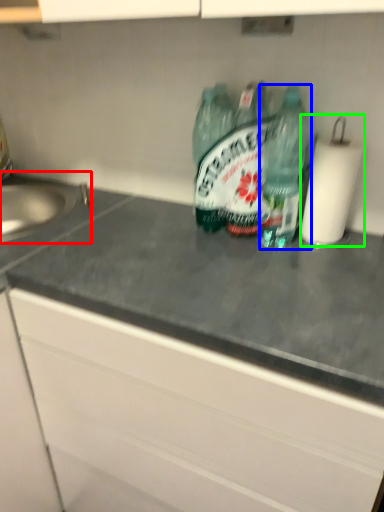
Question: Which object is the closest to the sink (highlighted by a red box)? Choose among these: bottle (highlighted by a blue box) or paper towel (highlighted by a green box).

Choices:
 (A) bottle
 (B) paper towel

Answer: (A)